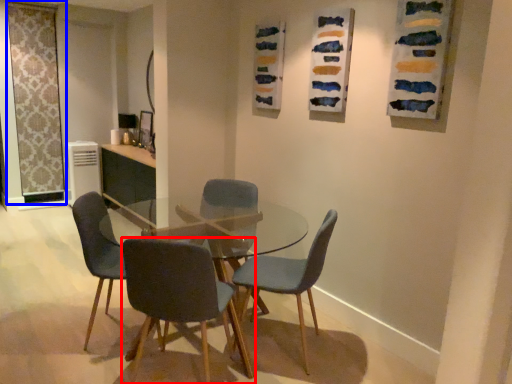
Question: Among these objects, which one is farthest to the camera, chair (highlighted by a red box) or screen door (highlighted by a blue box)?

Choices:
 (A) chair
 (B) screen door

Answer: (B)